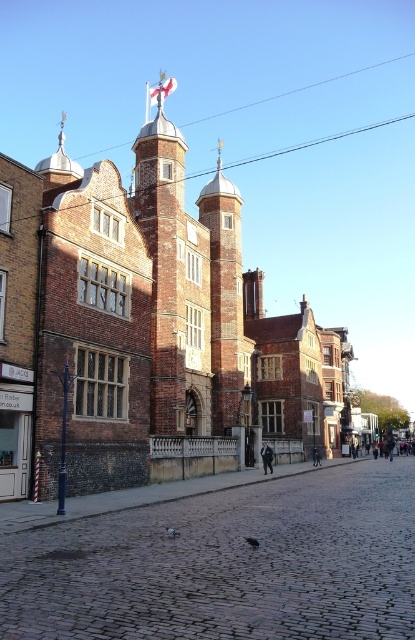
You are a tourist standing in front of the historic brick building. You see the brick bell tower at center and the dark blue jeans at center. Which object is bigger?

The brick bell tower at center is larger in size than the dark blue jeans at center.

You are standing on the cobblestone street in front of the historic brick building. You see two points marked on the ground. The first point is at coordinates point (212, 326) and the second is at point (263, 472). Which point is closer to the building?

Point (212, 326) is behind point (263, 472), so the point closer to the building is point (263, 472).

You are standing on the cobblestone street in front of the historic brick building. You see the brick bell tower at center and the dark blue jeans at center. From your perspective, which object is positioned to the left?

The brick bell tower at center is to the left of dark blue jeans at center, so the brick bell tower at center is positioned to the left.